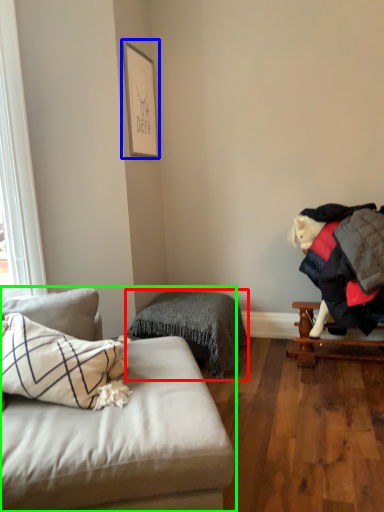
Question: Which is nearer to the bedding (highlighted by a red box)? picture frame (highlighted by a blue box) or studio couch (highlighted by a green box).

Choices:
 (A) picture frame
 (B) studio couch

Answer: (B)